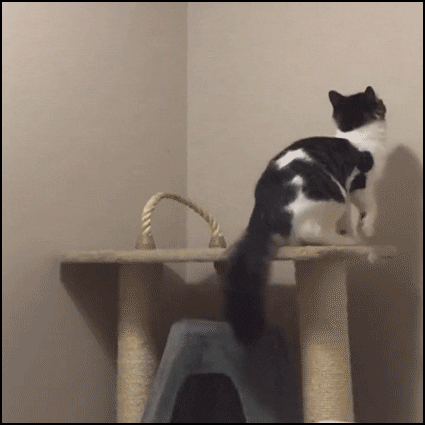
You are a GUI agent. You are given a task and a screenshot of the screen. Output one action in this format:
    pyautogui.click(x=<x>, y=<y>)
    Task: Click on the wooden slab
    
    Given the screenshot: What is the action you would take?
    pyautogui.click(x=279, y=259)